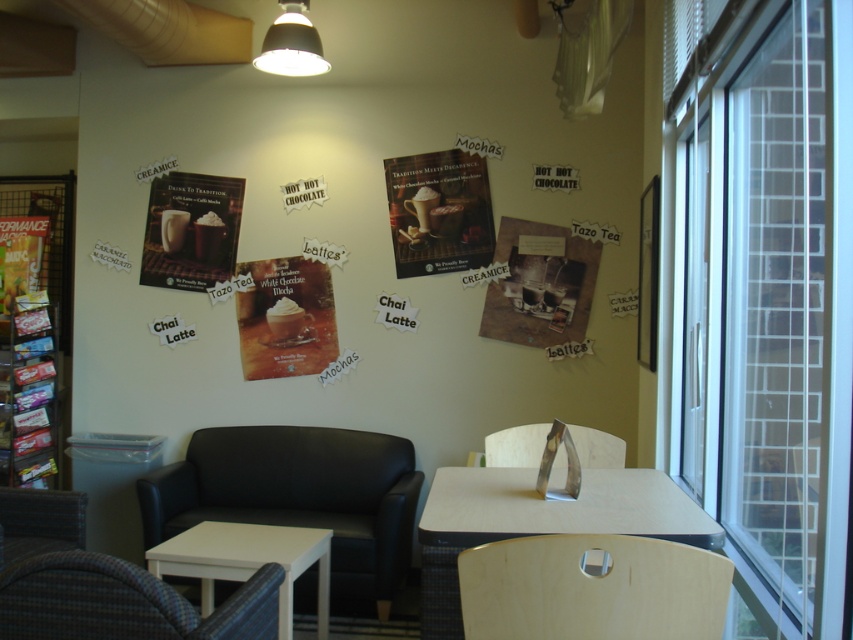
Does metallic silver bookshelf at left have a lesser width compared to woven rattan armchair at lower left?

In fact, metallic silver bookshelf at left might be wider than woven rattan armchair at lower left.

Does point (54, 339) lie behind point (61, 496)?

Yes, it is.

Describe the element at coordinates (28, 394) in the screenshot. I see `metallic silver bookshelf at left` at that location.

Image resolution: width=853 pixels, height=640 pixels. I want to click on metallic silver bookshelf at left, so click(x=28, y=394).

Does point (297, 506) come behind point (6, 492)?

Yes, point (297, 506) is behind point (6, 492).

Is black leather armchair at center in front of woven rattan armchair at lower left?

No, it is behind woven rattan armchair at lower left.

Who is more forward, (x=196, y=461) or (x=27, y=513)?

Point (x=27, y=513) is more forward.

Locate an element on the screen. The image size is (853, 640). black leather armchair at center is located at coordinates (299, 496).

Can you confirm if plaid fabric armchair at lower left is shorter than matte white poster at center?

Yes.

How far apart are plaid fabric armchair at lower left and matte white poster at center?

plaid fabric armchair at lower left and matte white poster at center are 2.28 meters apart from each other.

Between point (4, 602) and point (262, 312), which one is positioned in front?

Point (4, 602) is more forward.

Where is `plaid fabric armchair at lower left`? This screenshot has height=640, width=853. plaid fabric armchair at lower left is located at coordinates (123, 602).